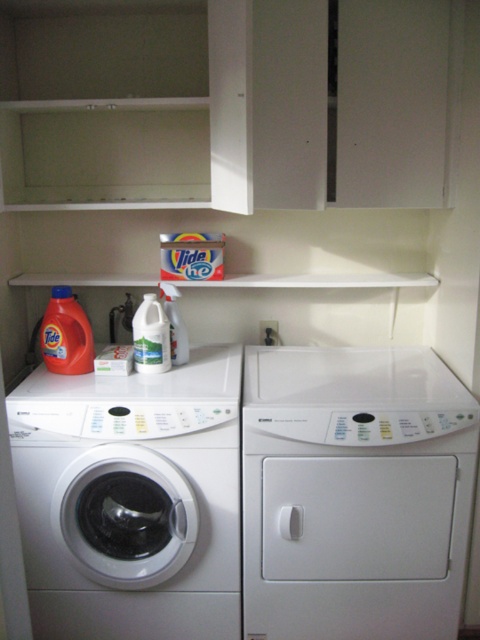
Question: Among these objects, which one is farthest from the camera?

Choices:
 (A) white glossy jug at center
 (B) white matte dryer at right
 (C) white glossy washing machine at lower left

Answer: (A)

Question: Does white glossy washing machine at lower left appear over white glossy jug at center?

Choices:
 (A) yes
 (B) no

Answer: (B)

Question: Which point appears farthest from the camera in this image?

Choices:
 (A) (166, 356)
 (B) (71, 332)

Answer: (A)

Question: Is white matte dryer at right further to the viewer compared to clear plastic bottle at center?

Choices:
 (A) no
 (B) yes

Answer: (A)

Question: Among these points, which one is farthest from the camera?

Choices:
 (A) (428, 454)
 (B) (172, 342)
 (C) (175, 500)
 (D) (144, 330)

Answer: (B)

Question: Is white glossy jug at center to the right of clear plastic bottle at center from the viewer's perspective?

Choices:
 (A) no
 (B) yes

Answer: (A)